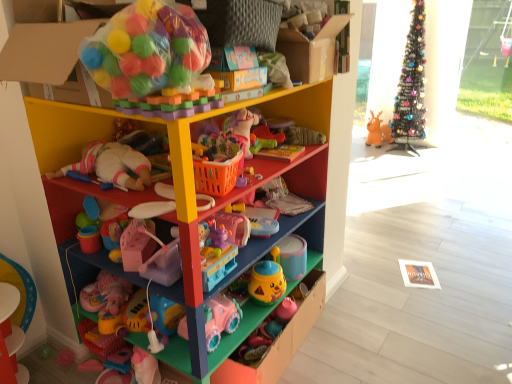
What are the coordinates of `vacant area to the right of matte plastic drawer at center` in the screenshot? It's located at (365, 337).